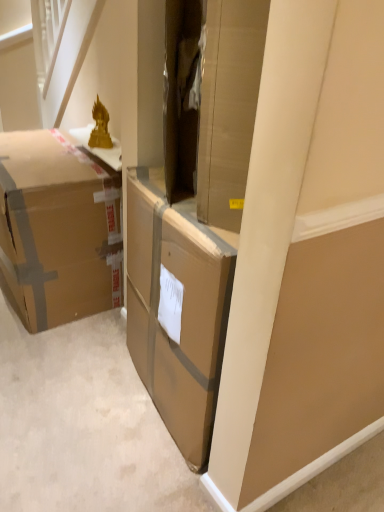
Image resolution: width=384 pixels, height=512 pixels. Describe the element at coordinates (58, 228) in the screenshot. I see `brown cardboard box at left` at that location.

Identify the location of brown cardboard box at left. (58, 228).

In order to face brown cardboard box at left, should I rotate leftwards or rightwards?

Turn left by 18.827 degrees to look at brown cardboard box at left.

This screenshot has height=512, width=384. What are the coordinates of `brown cardboard box at left` in the screenshot? It's located at (58, 228).